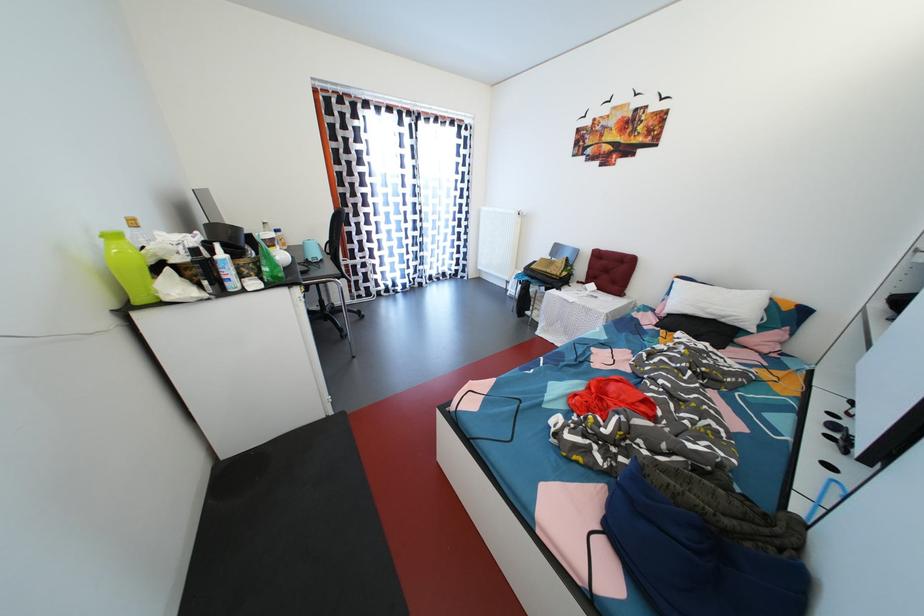
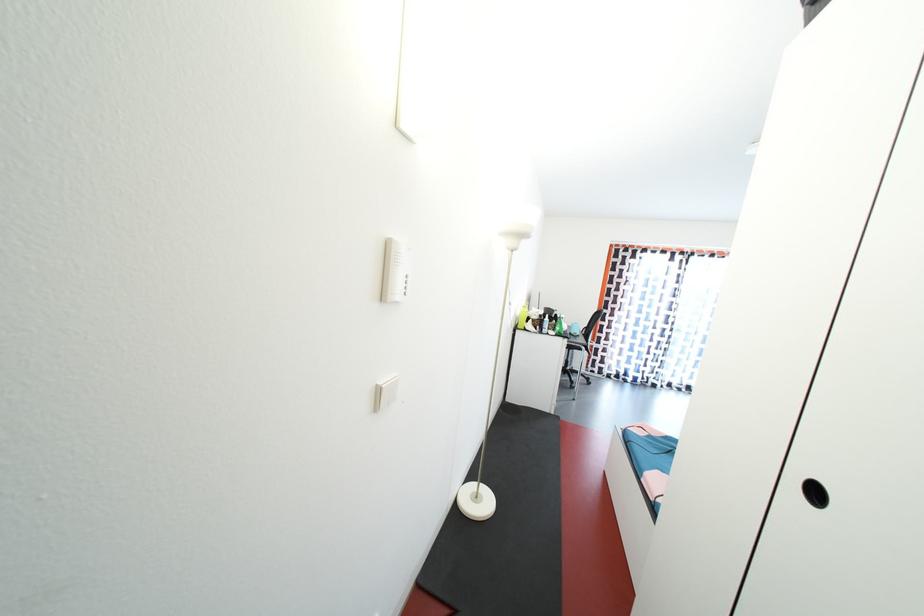
The point at (227, 261) is marked in the first image. Where is the corresponding point in the second image?

(553, 323)